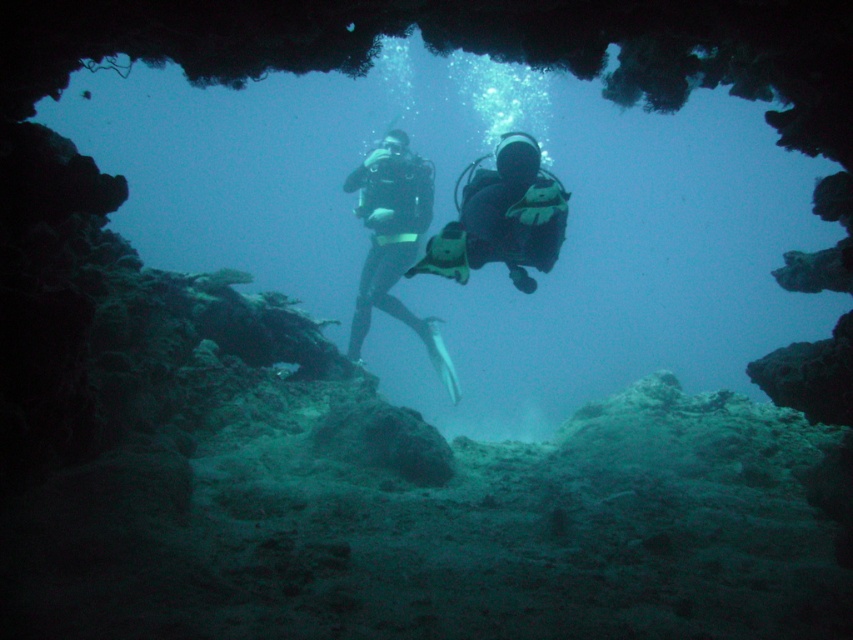
Question: Which point is closer to the camera?

Choices:
 (A) black matte wetsuit at center
 (B) black matte scuba diver at center

Answer: (A)

Question: Is black matte wetsuit at center closer to camera compared to black matte scuba diver at center?

Choices:
 (A) no
 (B) yes

Answer: (B)

Question: Where is black matte wetsuit at center located in relation to black matte scuba diver at center in the image?

Choices:
 (A) right
 (B) left

Answer: (A)

Question: Which point appears closest to the camera in this image?

Choices:
 (A) (544, 204)
 (B) (392, 132)

Answer: (A)

Question: Can you confirm if black matte wetsuit at center is positioned to the right of black matte scuba diver at center?

Choices:
 (A) yes
 (B) no

Answer: (A)